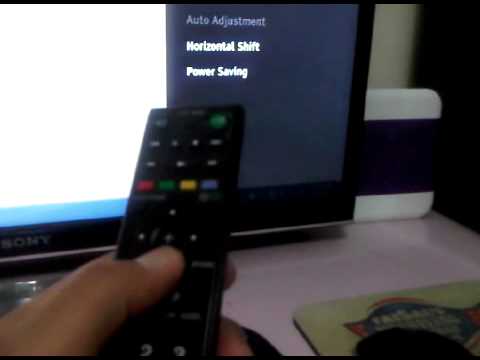
Locate an element on the screen. This screenshot has height=360, width=480. mouse pad is located at coordinates (444, 296).